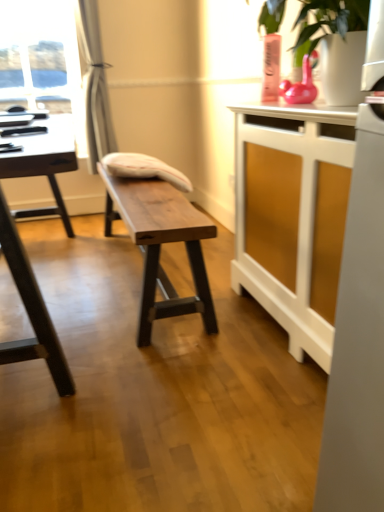
Question: Can you confirm if silky white curtain at left is thinner than white fabric cushion at center?

Choices:
 (A) no
 (B) yes

Answer: (B)

Question: Is silky white curtain at left not near white fabric cushion at center?

Choices:
 (A) no
 (B) yes

Answer: (A)

Question: From a real-world perspective, is silky white curtain at left below white fabric cushion at center?

Choices:
 (A) yes
 (B) no

Answer: (B)

Question: From the image's perspective, would you say silky white curtain at left is shown under white fabric cushion at center?

Choices:
 (A) no
 (B) yes

Answer: (A)

Question: Does silky white curtain at left appear on the left side of white fabric cushion at center?

Choices:
 (A) yes
 (B) no

Answer: (A)

Question: Is the depth of silky white curtain at left greater than that of white fabric cushion at center?

Choices:
 (A) yes
 (B) no

Answer: (A)

Question: Considering the relative sizes of white fabric cushion at center and black glossy table at left, the 1th table from the left, in the image provided, is white fabric cushion at center smaller than black glossy table at left, the 1th table from the left,?

Choices:
 (A) no
 (B) yes

Answer: (B)

Question: Can you confirm if white fabric cushion at center is positioned to the left of black glossy table at left, the 1th table from the left?

Choices:
 (A) no
 (B) yes

Answer: (A)

Question: Is white fabric cushion at center looking in the opposite direction of black glossy table at left, the 1th table from the left?

Choices:
 (A) no
 (B) yes

Answer: (A)

Question: From the image's perspective, would you say white fabric cushion at center is shown under black glossy table at left, the 1th table from the left?

Choices:
 (A) yes
 (B) no

Answer: (B)

Question: Is white fabric cushion at center outside black glossy table at left, the 3th table from the right?

Choices:
 (A) yes
 (B) no

Answer: (A)

Question: From a real-world perspective, is white fabric cushion at center positioned under black glossy table at left, the 1th table from the left, based on gravity?

Choices:
 (A) yes
 (B) no

Answer: (B)

Question: Is white wood cabinet at right, the 1th table positioned from the right, to the left of black glossy table at left, the 1th table from the left, from the viewer's perspective?

Choices:
 (A) no
 (B) yes

Answer: (A)